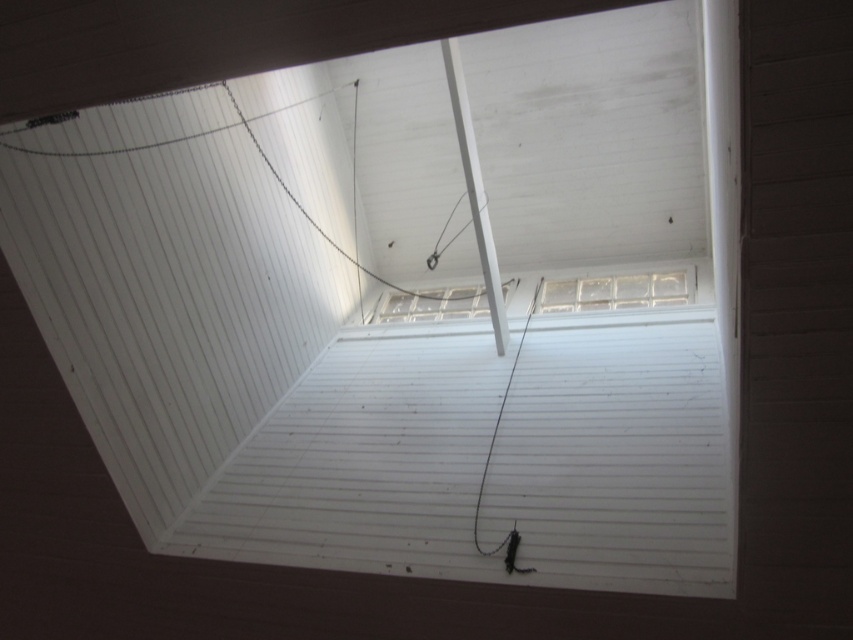
Question: Can you confirm if clear glass window at upper center is positioned above clear glass window at center?

Choices:
 (A) no
 (B) yes

Answer: (B)

Question: Does clear glass window at upper center have a lesser width compared to clear glass window at center?

Choices:
 (A) yes
 (B) no

Answer: (A)

Question: Estimate the real-world distances between objects in this image. Which object is farther from the white glossy beam at upper center?

Choices:
 (A) clear glass window at upper center
 (B) clear glass window at center

Answer: (B)

Question: Which point is closer to the camera?

Choices:
 (A) clear glass window at center
 (B) clear glass window at upper center
 (C) white glossy beam at upper center

Answer: (C)

Question: Which of the following is the farthest from the observer?

Choices:
 (A) pos(463,296)
 (B) pos(641,298)

Answer: (A)

Question: Can you confirm if clear glass window at upper center is positioned below clear glass window at center?

Choices:
 (A) yes
 (B) no

Answer: (B)